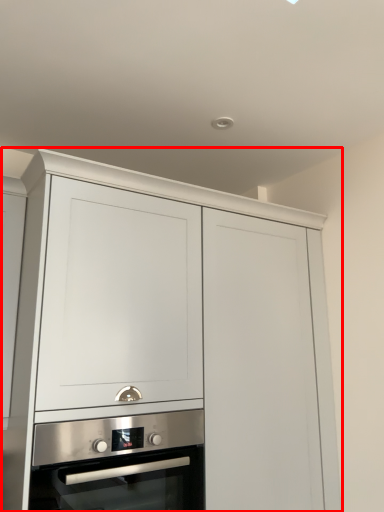
Question: Considering the relative positions of cabinetry (annotated by the red box) and oven in the image provided, where is cabinetry (annotated by the red box) located with respect to the staircase?

Choices:
 (A) left
 (B) right

Answer: (B)